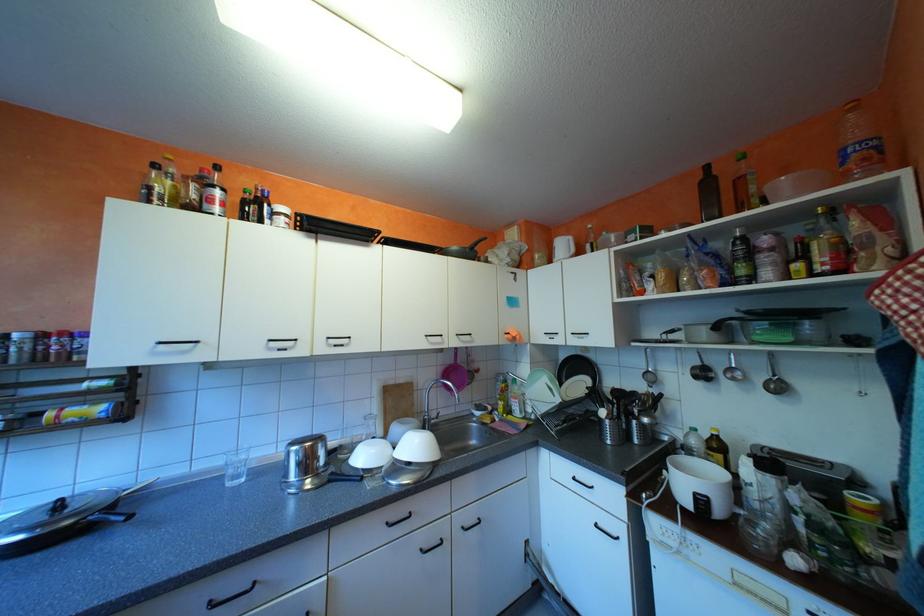
What do you see at coordinates (699, 485) in the screenshot?
I see `a white bowl` at bounding box center [699, 485].